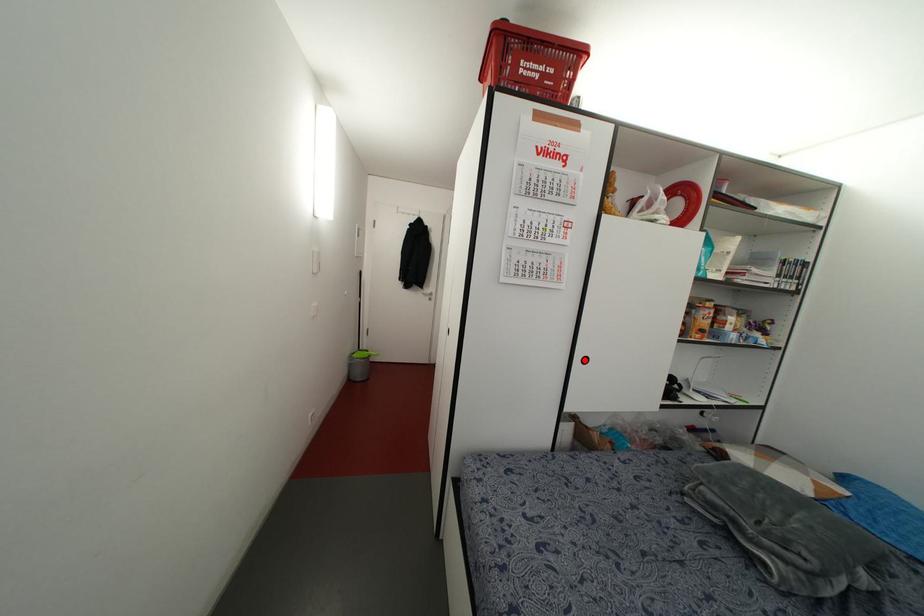
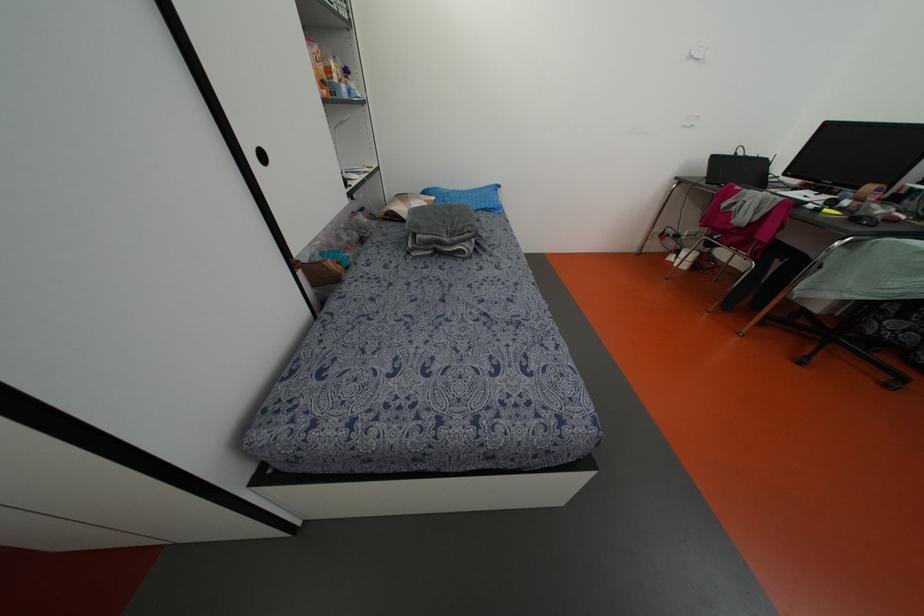
The point at the highlighted location is marked in the first image. Where is the corresponding point in the second image?

(262, 156)